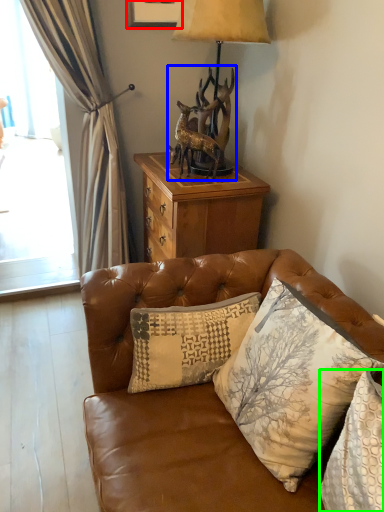
Question: Based on their relative distances, which object is farther from picture frame (highlighted by a red box)? Choose from animal (highlighted by a blue box) and pillow (highlighted by a green box).

Choices:
 (A) animal
 (B) pillow

Answer: (B)